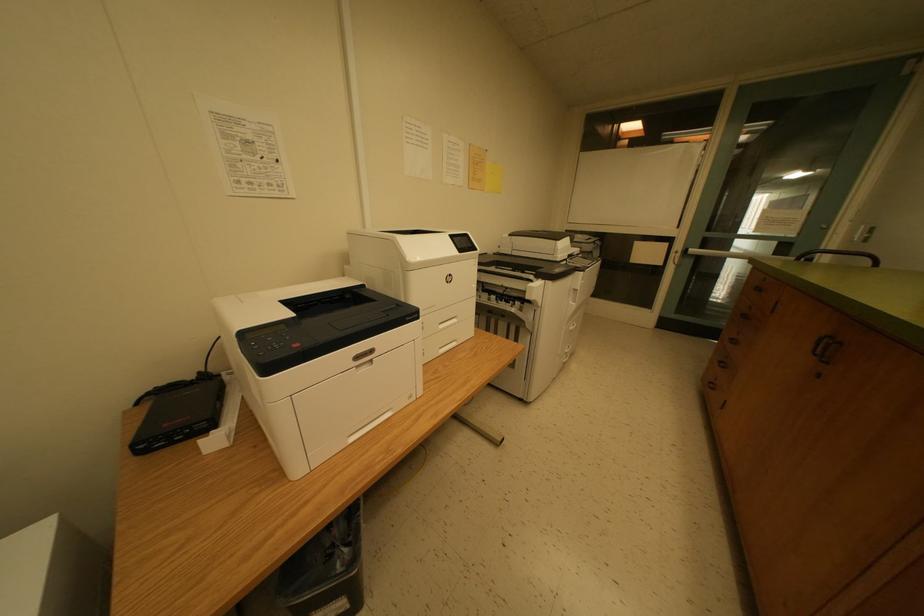
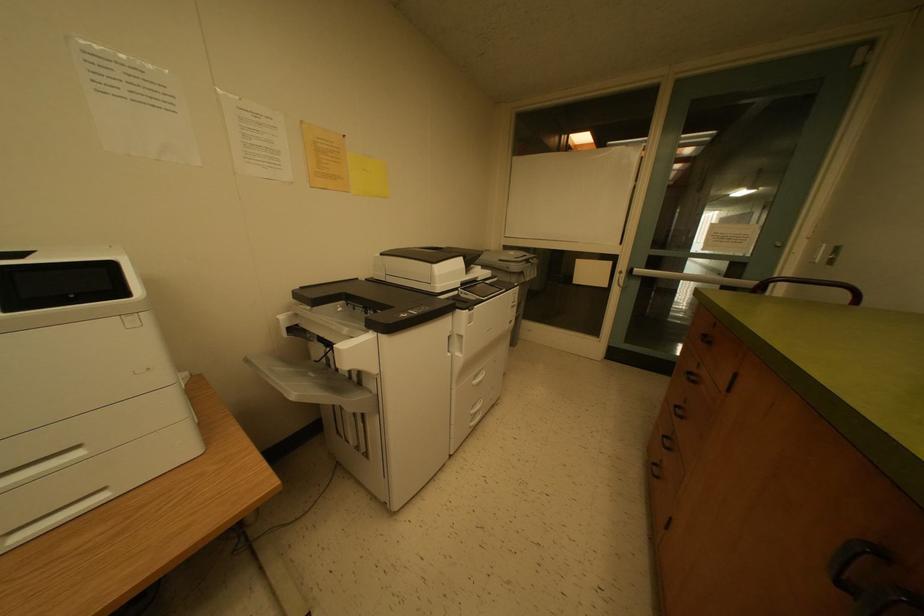
Question: The camera is either moving clockwise (left) or counter-clockwise (right) around the object. The first image is from the beginning of the video and the second image is from the end. Is the camera moving left or right when shooting the video?

Choices:
 (A) Left
 (B) Right

Answer: (A)